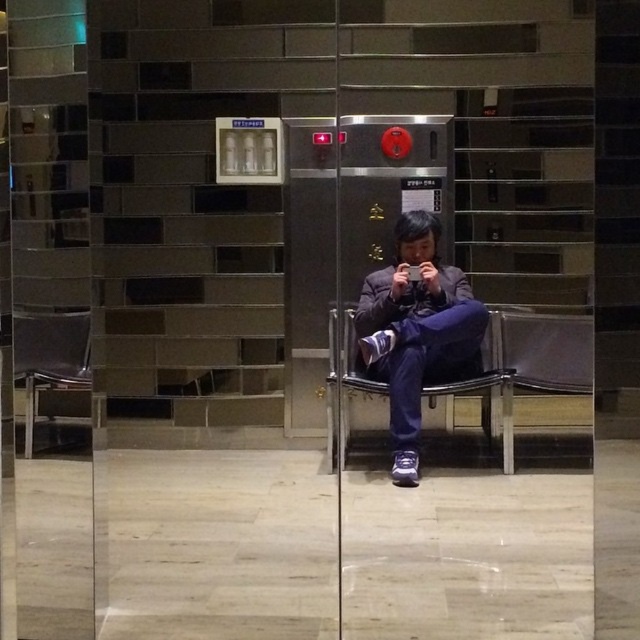
Question: Which object appears farthest from the camera in this image?

Choices:
 (A) matte purple pants at center
 (B) transparent glass door at center

Answer: (A)

Question: Which point appears closest to the camera in this image?

Choices:
 (A) (408, 276)
 (B) (436, 492)
 (C) (24, 348)

Answer: (C)

Question: From the image, what is the correct spatial relationship of metallic silver chair at left in relation to matte black phone at center?

Choices:
 (A) left
 (B) right

Answer: (A)

Question: Which point is closer to the camera?

Choices:
 (A) (70, 388)
 (B) (436, 349)

Answer: (A)

Question: Can you confirm if matte purple pants at center is positioned above matte black phone at center?

Choices:
 (A) yes
 (B) no

Answer: (B)

Question: Does transparent glass door at center appear under metallic silver chair at left?

Choices:
 (A) yes
 (B) no

Answer: (B)